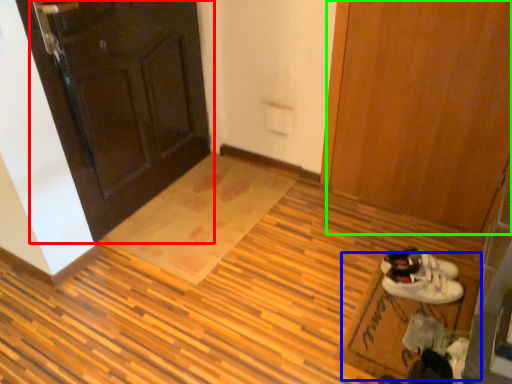
Question: Based on their relative distances, which object is nearer to door (highlighted by a red box)? Choose from doormat (highlighted by a blue box) and door (highlighted by a green box).

Choices:
 (A) doormat
 (B) door

Answer: (B)